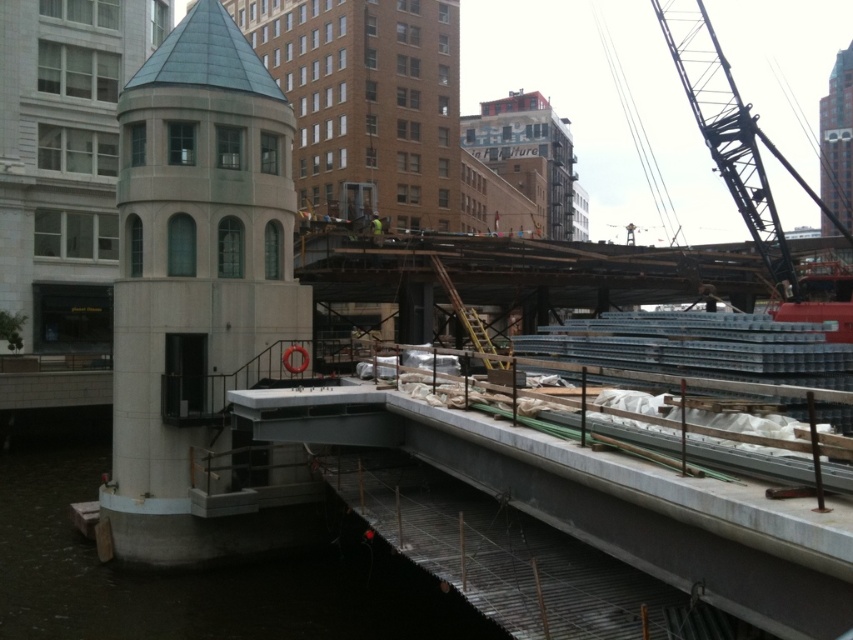
Question: Is dark gray concrete waterway at lower left to the right of metallic industrial crane at upper right from the viewer's perspective?

Choices:
 (A) no
 (B) yes

Answer: (A)

Question: Which point appears closest to the camera in this image?

Choices:
 (A) (x=723, y=156)
 (B) (x=59, y=420)

Answer: (A)

Question: Which of the following is the closest to the observer?

Choices:
 (A) dark gray concrete waterway at lower left
 (B) metallic industrial crane at upper right

Answer: (A)

Question: Is dark gray concrete waterway at lower left above metallic industrial crane at upper right?

Choices:
 (A) no
 (B) yes

Answer: (A)

Question: Is dark gray concrete waterway at lower left above metallic industrial crane at upper right?

Choices:
 (A) no
 (B) yes

Answer: (A)